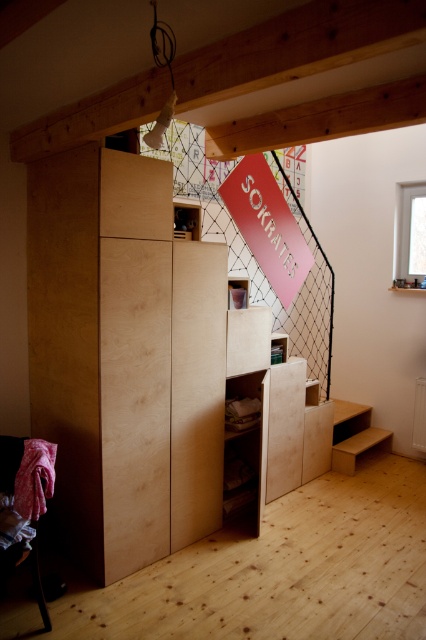
Question: Does matte pink sign at upper center have a greater width compared to light wood/stained wood stair at lower right?

Choices:
 (A) no
 (B) yes

Answer: (B)

Question: Which point is farther to the camera?

Choices:
 (A) click(301, 275)
 (B) click(345, 406)

Answer: (B)

Question: Is matte pink sign at upper center to the left of light wood/stained wood stair at lower right from the viewer's perspective?

Choices:
 (A) yes
 (B) no

Answer: (A)

Question: Is matte pink sign at upper center to the left of light wood/stained wood stair at lower right from the viewer's perspective?

Choices:
 (A) yes
 (B) no

Answer: (A)